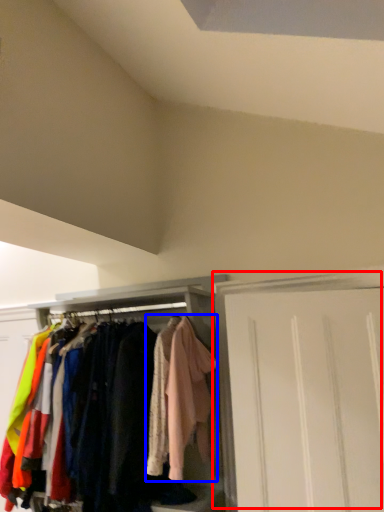
Question: Among these objects, which one is nearest to the camera, door (highlighted by a red box) or clothing (highlighted by a blue box)?

Choices:
 (A) door
 (B) clothing

Answer: (A)